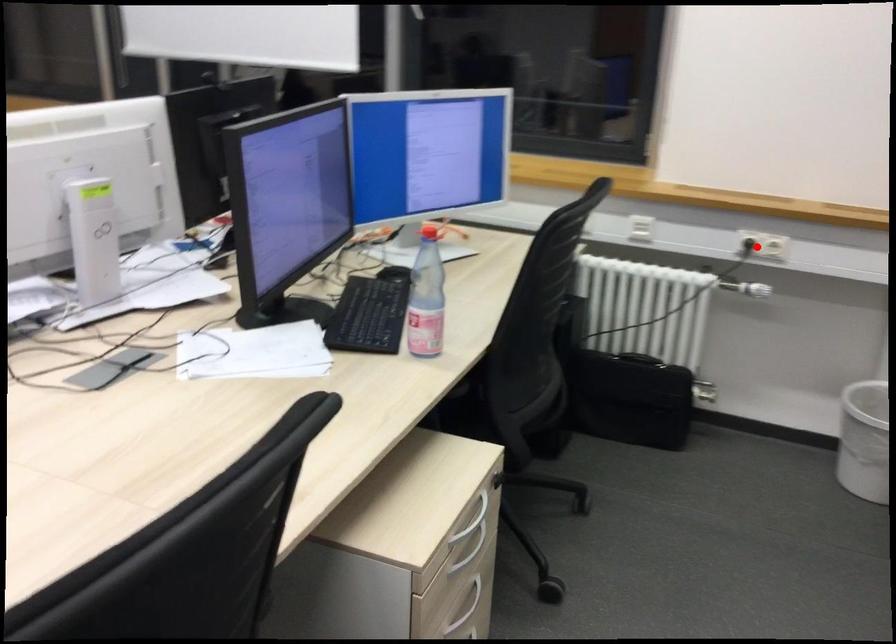
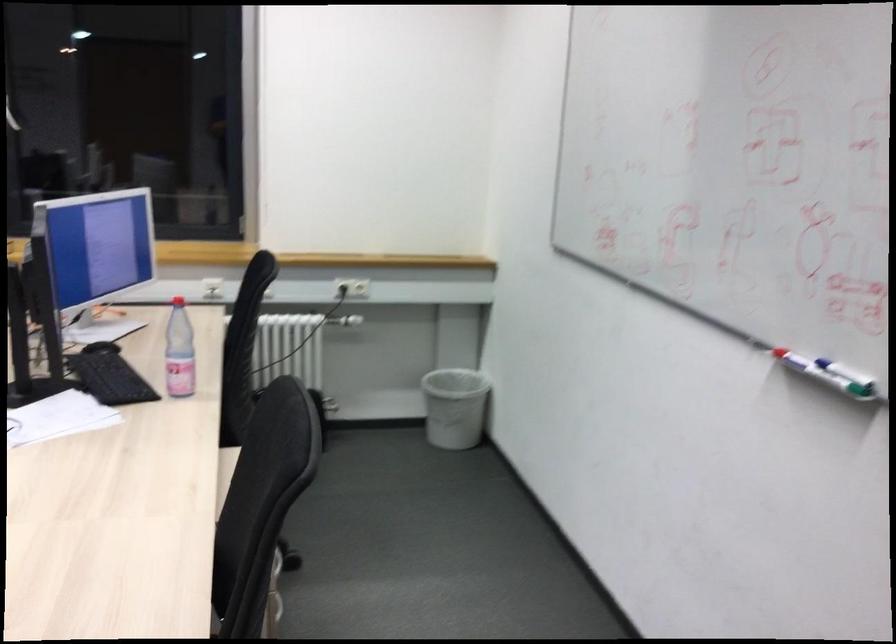
Find the pixel in the second image that matches the highlighted location in the first image.

(352, 287)